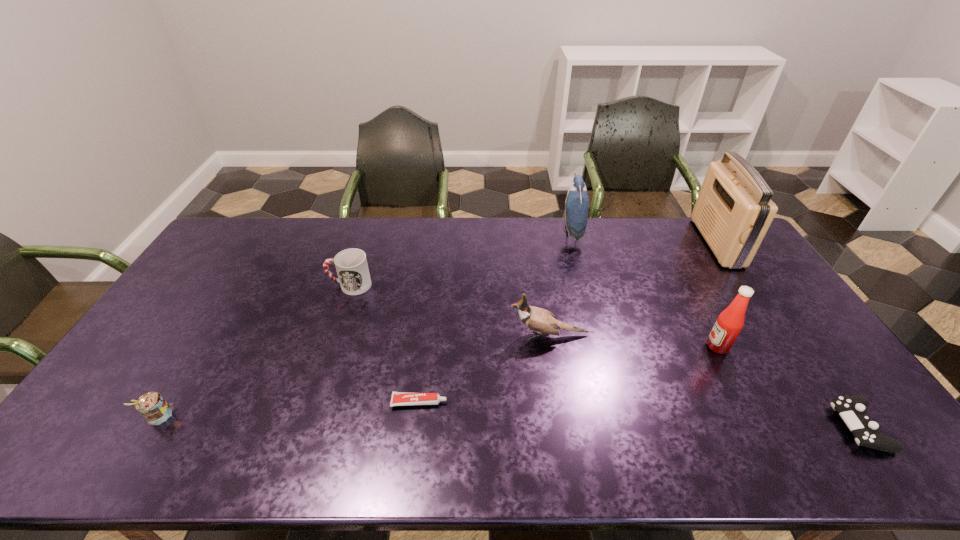
This screenshot has height=540, width=960. What are the coordinates of `the sixth object from right to left` in the screenshot? It's located at (398, 398).

Locate an element on the screen. The height and width of the screenshot is (540, 960). toothpaste is located at coordinates (398, 398).

At what (x,y) coordinates should I click in order to perform the action: click on vacant region located on the front-facing side of the radio receiver. Please return your answer as a coordinate pair (x, y). Looking at the image, I should click on click(604, 242).

Identify the location of vacant region located on the front-facing side of the radio receiver. (638, 242).

You are a GUI agent. You are given a task and a screenshot of the screen. Output one action in this format:
    pyautogui.click(x=<x>, y=<y>)
    Task: Click on the vacant space located 0.210m on the front-facing side of the radio receiver
    The height and width of the screenshot is (540, 960).
    Given the screenshot: What is the action you would take?
    pyautogui.click(x=646, y=242)

Locate an element on the screen. The image size is (960, 540). vacant space situated 0.270m at the tip of the farther bird's beak is located at coordinates (491, 232).

I want to click on vacant space located at the tip of the farther bird's beak, so click(509, 232).

Find the location of a particular element. This screenshot has width=960, height=540. free location located at the tip of the farther bird's beak is located at coordinates (517, 232).

I want to click on blank space located 0.290m on the front-facing side of the condiment, so click(x=606, y=346).

The height and width of the screenshot is (540, 960). Find the location of `free space located on the front-facing side of the condiment`. free space located on the front-facing side of the condiment is located at coordinates (567, 346).